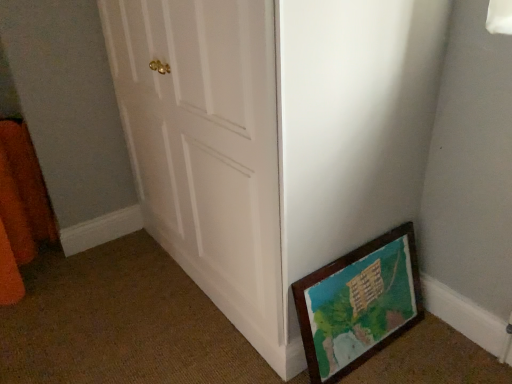
This screenshot has width=512, height=384. I want to click on vacant point to the right of wooden picture frame at lower right, so click(436, 349).